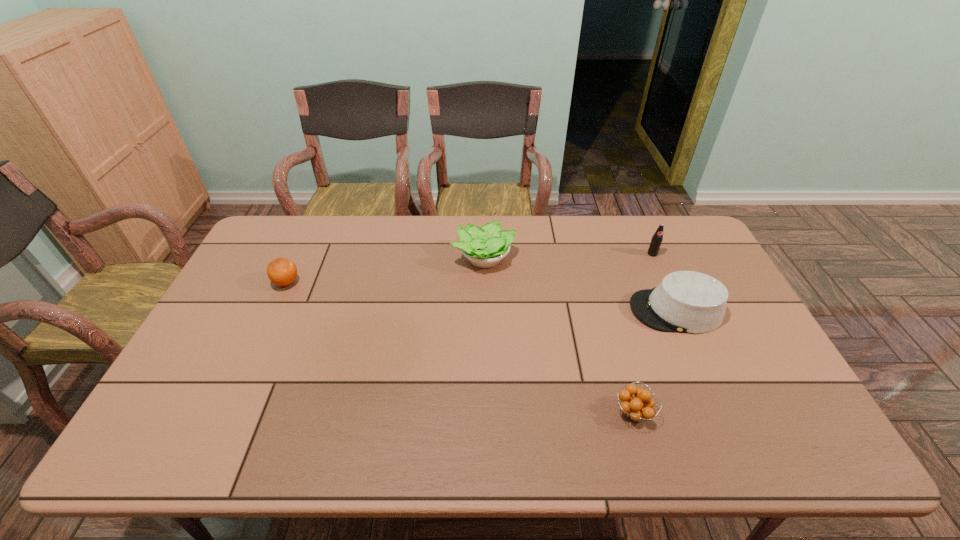
Identify the location of free region located 0.280m on the front-facing side of the hat. (537, 310).

What are the coordinates of `free spot located on the front-facing side of the hat` in the screenshot? It's located at (603, 310).

What are the coordinates of `free spot located on the left of the left orange fruit` in the screenshot? It's located at (239, 283).

Locate an element on the screen. blank area located on the right of the right orange fruit is located at coordinates (744, 412).

At what (x,y) coordinates should I click in order to perform the action: click on pop present at the far edge. Please return your answer as a coordinate pair (x, y). Looking at the image, I should click on (656, 240).

Find the location of a particular element. The height and width of the screenshot is (540, 960). lettuce at the far edge is located at coordinates (484, 247).

Image resolution: width=960 pixels, height=540 pixels. Identify the location of object present at the near edge. (638, 408).

The image size is (960, 540). In order to click on object located at the left edge in this screenshot , I will do `click(281, 271)`.

What are the coordinates of `object that is at the right edge` in the screenshot? It's located at (685, 301).

At what (x,y) coordinates should I click in order to perform the action: click on blank area at the far edge. Please return your answer as a coordinate pair (x, y). Image resolution: width=960 pixels, height=540 pixels. Looking at the image, I should click on (647, 242).